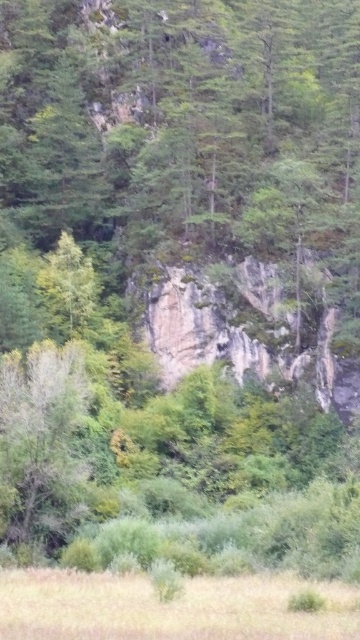
Question: Estimate the real-world distances between objects in this image. Which object is closer to the dry grass at lower center?

Choices:
 (A) green matte tree at lower left
 (B) green matte tree at center

Answer: (A)

Question: Observing the image, what is the correct spatial positioning of dry grass at lower center in reference to green matte tree at center?

Choices:
 (A) below
 (B) above

Answer: (A)

Question: Can you confirm if dry grass at lower center is thinner than green matte tree at lower left?

Choices:
 (A) yes
 (B) no

Answer: (B)

Question: Which point is farther from the camera taking this photo?

Choices:
 (A) [x=81, y=506]
 (B) [x=156, y=330]

Answer: (B)

Question: Does dry grass at lower center appear on the left side of green matte tree at center?

Choices:
 (A) yes
 (B) no

Answer: (B)

Question: Estimate the real-world distances between objects in this image. Which object is closer to the dry grass at lower center?

Choices:
 (A) green matte tree at lower left
 (B) green matte tree at center

Answer: (A)